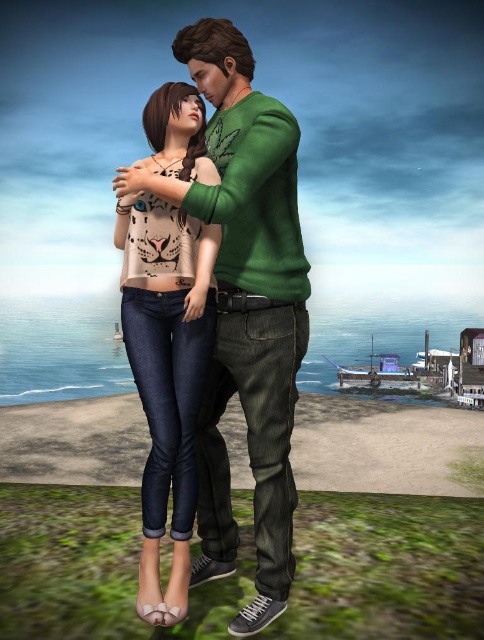
Identify the location of matte green sweater at center. The image size is (484, 640). (245, 307).

Is matte green sweater at center positioned at the back of matte beige top at center?

Yes, matte green sweater at center is behind matte beige top at center.

This screenshot has width=484, height=640. What do you see at coordinates (245, 307) in the screenshot?
I see `matte green sweater at center` at bounding box center [245, 307].

Locate an element on the screen. matte green sweater at center is located at coordinates (245, 307).